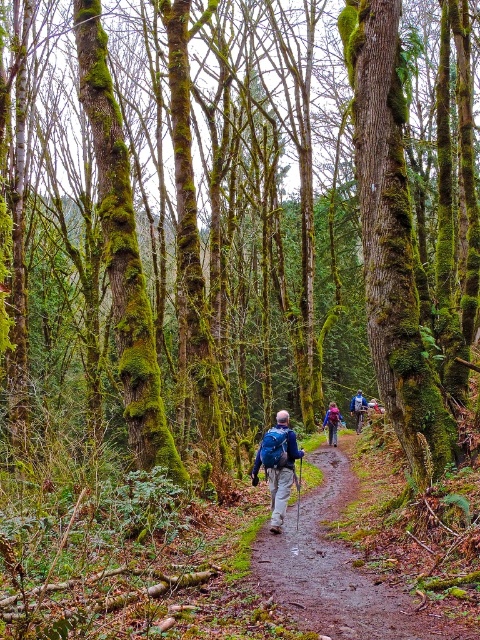
You are a hiker carrying a matte purple backpack at center and you see a mossy tree trunk 30.70 meters away. Can you safely walk towards the mossy tree trunk without leaving the forest path?

The distance between the matte purple backpack at center and the mossy tree trunk is 30.70 meters. Since the path is narrow and winding, it is possible to walk towards the mossy tree trunk while staying on the path, but caution is advised due to the path being narrow and the forest environment being uneven.

You are a hiker carrying a matte blue backpack at center and standing near a green mossy tree at center. If you want to place your backpack against the tree trunk, will the backpack fit entirely within the width of the tree?

The green mossy tree at center is wider than the matte blue backpack at center, so the backpack will fit entirely within the width of the tree.